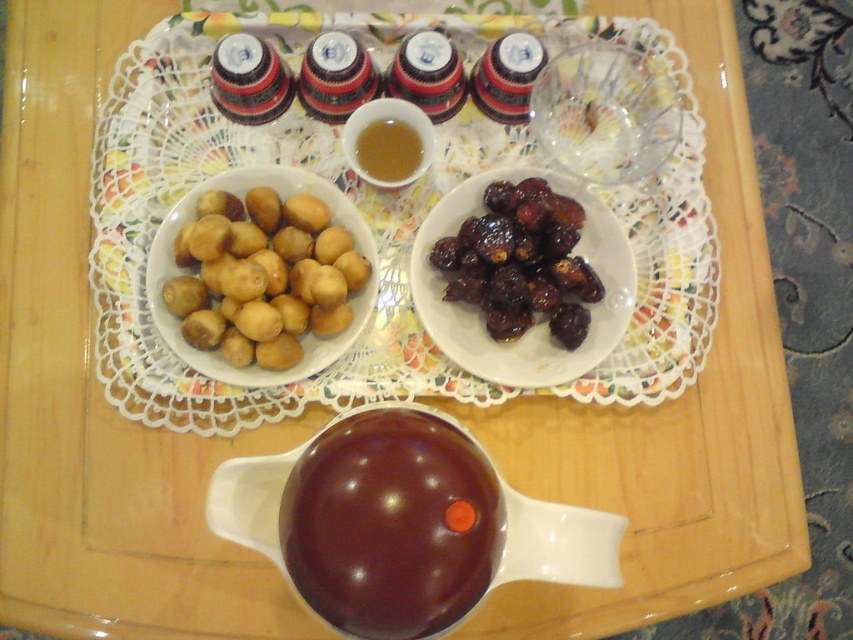
Based on the photo, can you confirm if golden matte potatoes at left is positioned below shiny dark brown dates at center right?

Yes.

Between point (294, 269) and point (558, 236), which one is positioned in front?

Positioned in front is point (558, 236).

What do you see at coordinates (263, 276) in the screenshot?
I see `golden matte potatoes at left` at bounding box center [263, 276].

The width and height of the screenshot is (853, 640). Find the location of `golden matte potatoes at left`. golden matte potatoes at left is located at coordinates (263, 276).

Can you confirm if shiny brown bowl at center is thinner than shiny dark brown dates at center right?

Incorrect, shiny brown bowl at center's width is not less than shiny dark brown dates at center right's.

Looking at this image, who is more distant from viewer, (322, 468) or (480, 241)?

The point (480, 241) is behind.

What are the coordinates of `shiny brown bowl at center` in the screenshot? It's located at (390, 524).

Is white ceramic platter at center behind shiny dark brown dates at center right?

Yes, it is.

Who is more forward, (x=686, y=224) or (x=473, y=289)?

Point (x=473, y=289)

Who is more forward, (415, 337) or (520, 193)?

Positioned in front is point (520, 193).

At what (x,y) coordinates should I click in order to perform the action: click on white ceramic platter at center. Please return your answer as a coordinate pair (x, y). The width and height of the screenshot is (853, 640). Looking at the image, I should click on (167, 189).